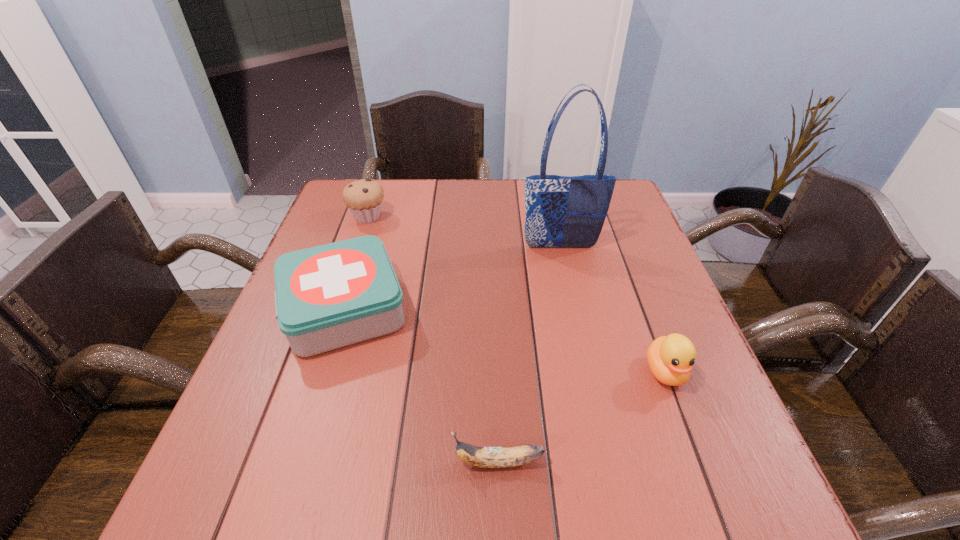
I want to click on free spot located on the face of the duckling, so [x=684, y=420].

You are a GUI agent. You are given a task and a screenshot of the screen. Output one action in this format:
    pyautogui.click(x=<x>, y=<y>)
    Task: Click on the vacant point located 0.210m at the stem of the banana
    This screenshot has height=540, width=960.
    Given the screenshot: What is the action you would take?
    pyautogui.click(x=326, y=462)

The width and height of the screenshot is (960, 540). Identify the location of vacant space situated at the stem of the banana. (314, 462).

Locate an element on the screen. vacant space located 0.390m at the stem of the banana is located at coordinates (217, 462).

Where is `object that is at the far edge`? object that is at the far edge is located at coordinates (364, 198).

You are a GUI agent. You are given a task and a screenshot of the screen. Output one action in this format:
    pyautogui.click(x=<x>, y=<y>)
    Task: Click on the object situated at the near edge
    This screenshot has width=960, height=540.
    Given the screenshot: What is the action you would take?
    (485, 457)

The width and height of the screenshot is (960, 540). I want to click on muffin located in the left edge section of the desktop, so click(364, 198).

At what (x,y) coordinates should I click in order to perform the action: click on the first-aid kit that is at the left edge. Please return your answer as a coordinate pair (x, y). Image resolution: width=960 pixels, height=540 pixels. Looking at the image, I should click on (326, 297).

Identify the location of shopping bag at the right edge. (561, 211).

Locate an element on the screen. Image resolution: width=960 pixels, height=540 pixels. duckling positioned at the right edge is located at coordinates (671, 358).